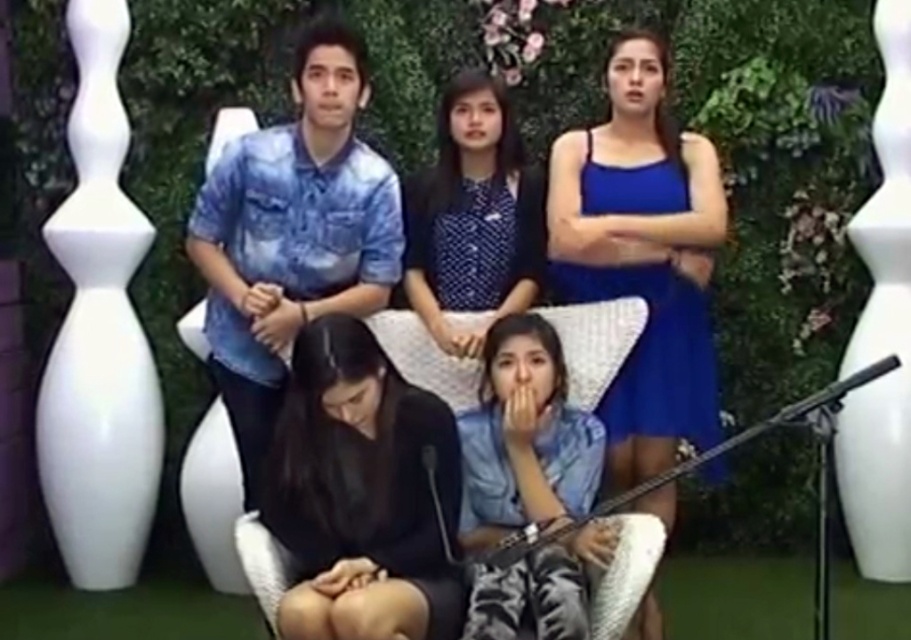
The height and width of the screenshot is (640, 911). In order to click on blue tie-dye shirt at upper left in this screenshot , I will do `click(292, 234)`.

Does point (315, 262) lie in front of point (431, 520)?

That is False.

In order to click on blue tie-dye shirt at upper left in this screenshot , I will do `click(292, 234)`.

Which is behind, point (242, 314) or point (495, 275)?

The point (495, 275) is behind.

Between blue tie-dye shirt at upper left and polka dot blouse at center, which one is positioned lower?

blue tie-dye shirt at upper left

Which is behind, point (252, 294) or point (485, 225)?

Positioned behind is point (485, 225).

At what (x,y) coordinates should I click in order to perform the action: click on blue tie-dye shirt at upper left. Please return your answer as a coordinate pair (x, y). Image resolution: width=911 pixels, height=640 pixels. Looking at the image, I should click on (292, 234).

Looking at this image, which is more to the right, blue satin dress at upper right or blue tie-dye shirt at upper left?

From the viewer's perspective, blue satin dress at upper right appears more on the right side.

Does blue satin dress at upper right have a larger size compared to blue tie-dye shirt at upper left?

Yes.

Is point (495, 163) positioned after point (326, 140)?

Yes, point (495, 163) is behind point (326, 140).

The image size is (911, 640). I want to click on blue satin dress at upper right, so click(x=578, y=241).